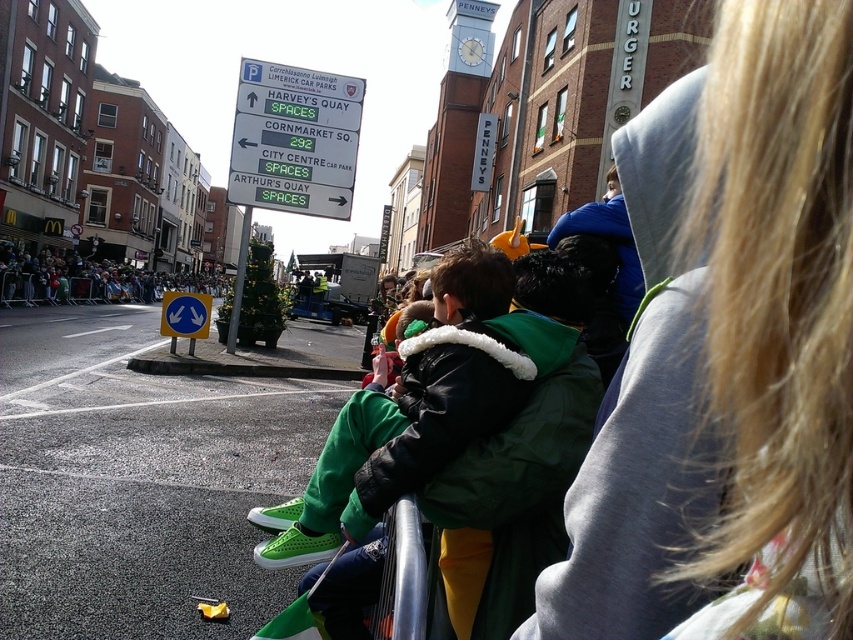
Does green fleece jacket at center have a lesser height compared to green fabric crowd at left?

Yes.

Who is more forward, (631,467) or (140,276)?

Positioned in front is point (631,467).

Identify the location of green fleece jacket at center. (735, 369).

Between green fabric crowd at left and metallic silver rail at lower center, which one appears on the right side from the viewer's perspective?

Positioned to the right is metallic silver rail at lower center.

Can you confirm if green fabric crowd at left is positioned to the right of metallic silver rail at lower center?

In fact, green fabric crowd at left is to the left of metallic silver rail at lower center.

Between point (24, 257) and point (397, 634), which one is positioned in front?

Point (397, 634) is more forward.

You are a GUI agent. You are given a task and a screenshot of the screen. Output one action in this format:
    pyautogui.click(x=<x>, y=<y>)
    Task: Click on the green fabric crowd at left
    
    Given the screenshot: What is the action you would take?
    pyautogui.click(x=86, y=280)

Describe the element at coordinates (294, 140) in the screenshot. I see `white plastic sign at upper left` at that location.

Is white plastic sign at upper left to the right of green fabric crowd at left from the viewer's perspective?

Yes, white plastic sign at upper left is to the right of green fabric crowd at left.

Locate an element on the screen. white plastic sign at upper left is located at coordinates (294, 140).